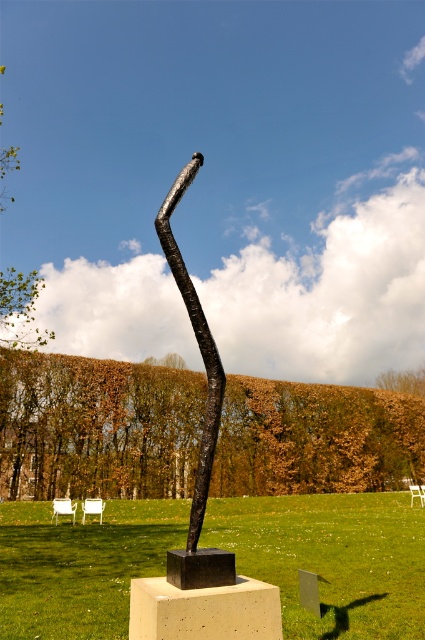
Question: In this image, where is green grass at center located relative to black textured pole at center?

Choices:
 (A) above
 (B) below

Answer: (B)

Question: From the image, what is the correct spatial relationship of green grass at center in relation to black textured pole at center?

Choices:
 (A) above
 (B) below

Answer: (B)

Question: Which object appears closest to the camera in this image?

Choices:
 (A) green grass at center
 (B) black textured pole at center

Answer: (B)

Question: Can you confirm if green grass at center is positioned to the left of black textured pole at center?

Choices:
 (A) no
 (B) yes

Answer: (B)

Question: Which point appears closest to the camera in this image?

Choices:
 (A) (308, 506)
 (B) (190, 310)

Answer: (B)

Question: Which point is farther to the camera?

Choices:
 (A) (121, 506)
 (B) (200, 348)

Answer: (A)